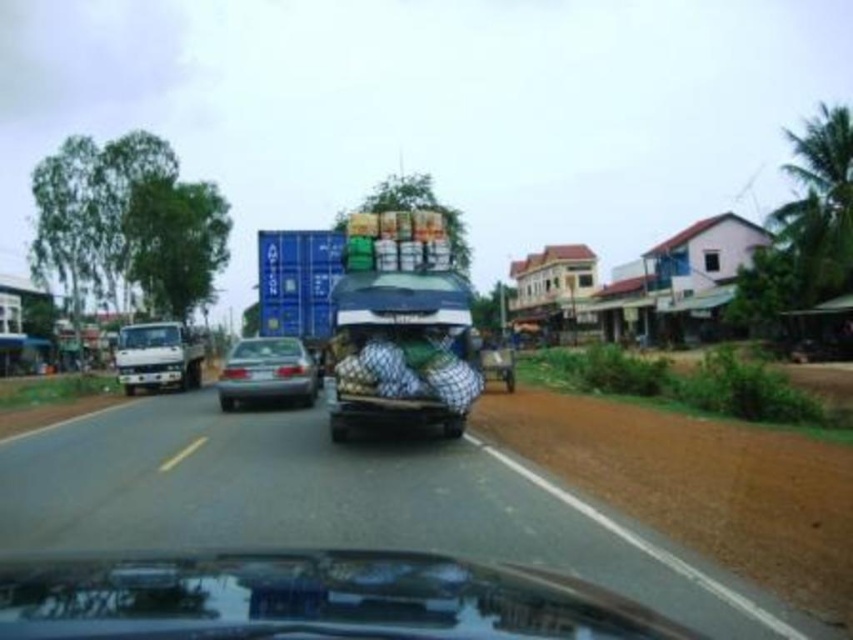
Question: Among these objects, which one is nearest to the camera?

Choices:
 (A) glossy black car at center
 (B) white matte truck at left
 (C) wooden cart at center

Answer: (A)

Question: Can you confirm if satin silver sedan at center is positioned to the left of wooden cart at center?

Choices:
 (A) yes
 (B) no

Answer: (A)

Question: Does glossy black car at center appear on the left side of wooden cart at center?

Choices:
 (A) yes
 (B) no

Answer: (A)

Question: Which object appears farthest from the camera in this image?

Choices:
 (A) wooden cart at center
 (B) white matte truck at left
 (C) satin silver sedan at center
 (D) glossy black car at center

Answer: (B)

Question: Which object is the closest to the white matte truck at left?

Choices:
 (A) satin silver sedan at center
 (B) wooden cart at center
 (C) glossy black car at center

Answer: (A)

Question: Is glossy black car at center bigger than white matte truck at left?

Choices:
 (A) no
 (B) yes

Answer: (A)